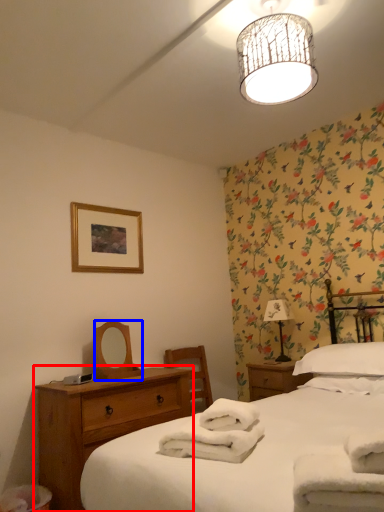
Question: Which of the following is the farthest to the observer, nightstand (highlighted by a red box) or mirror (highlighted by a blue box)?

Choices:
 (A) nightstand
 (B) mirror

Answer: (B)